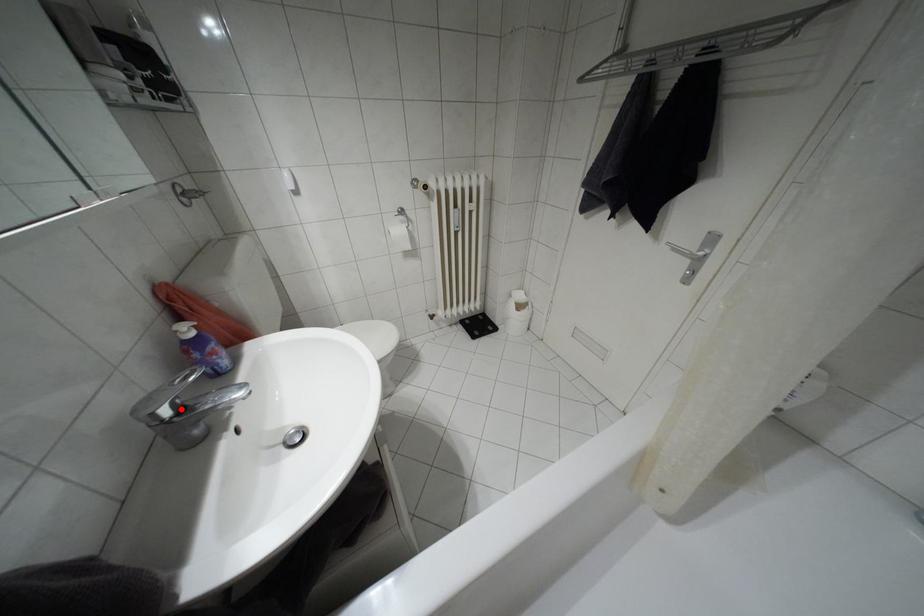
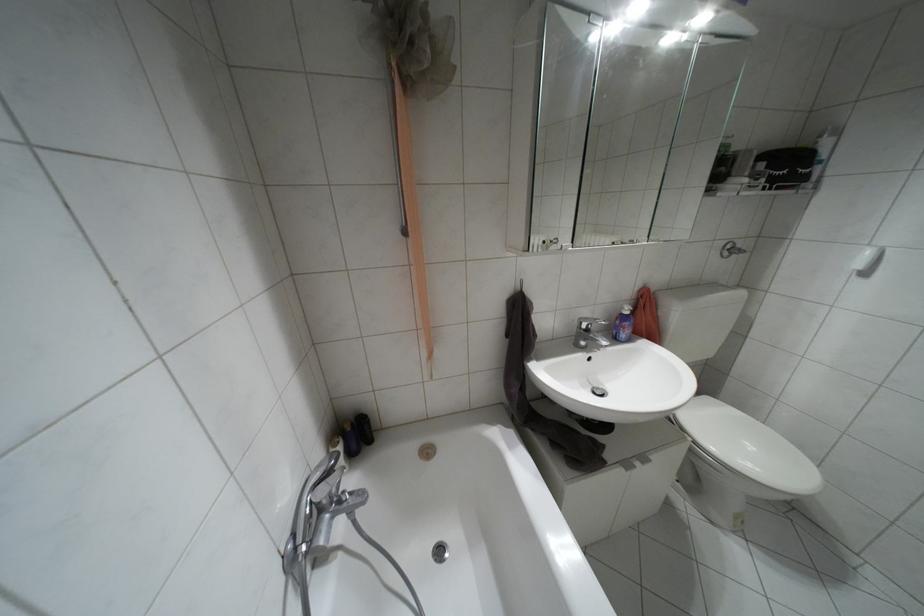
Locate, in the second image, the point that corresponds to the highlighted location in the first image.

(587, 330)